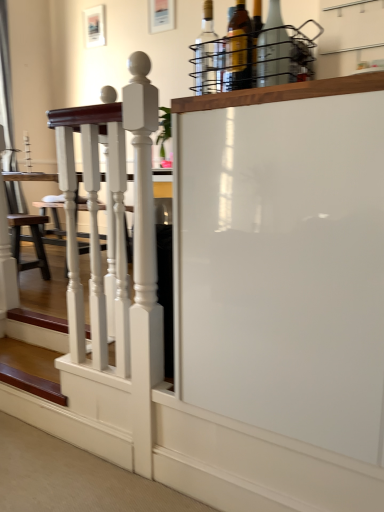
Where is `wooden stairs at lower left`? The width and height of the screenshot is (384, 512). wooden stairs at lower left is located at coordinates (39, 331).

At what (x,y) coordinates should I click in order to perform the action: click on translucent glass bottle at upper center, the second bottle when ordered from left to right. Please return your answer as a coordinate pair (x, y). Looking at the image, I should click on (230, 14).

What is the approximate width of brown leather stool at lower left?

The width of brown leather stool at lower left is 13.14 inches.

What do you see at coordinates (123, 287) in the screenshot?
I see `white glossy wooden railing at left` at bounding box center [123, 287].

Identify the location of translucent glass bottle at upper center, which appears as the 3th bottle when viewed from the right. Image resolution: width=384 pixels, height=512 pixels. (239, 49).

From the image's perspective, would you say brown leather stool at lower left is positioned over white glossy wooden railing at left?

Yes, from the image's perspective, brown leather stool at lower left is over white glossy wooden railing at left.

Which object is positioned more to the left, brown leather stool at lower left or white glossy wooden railing at left?

From the viewer's perspective, brown leather stool at lower left appears more on the left side.

Looking at this image, looking at their sizes, would you say brown leather stool at lower left is wider or thinner than white glossy wooden railing at left?

Clearly, brown leather stool at lower left has more width compared to white glossy wooden railing at left.

Can you confirm if brown leather stool at lower left is shorter than white glossy wooden railing at left?

Yes.

Which object is positioned more to the left, matte glass bottle at upper center, acting as the fourth bottle starting from the left, or translucent glass bottle at upper center, which appears as the 3th bottle when viewed from the left?

translucent glass bottle at upper center, which appears as the 3th bottle when viewed from the left.

Is the depth of matte glass bottle at upper center, acting as the fourth bottle starting from the left, less than that of translucent glass bottle at upper center, which appears as the 3th bottle when viewed from the left?

Yes, it is.

Where is `the 2nd bottle below the translucent glass bottle at upper center, which appears as the 3th bottle when viewed from the left (from the image's perspective)`? The height and width of the screenshot is (512, 384). the 2nd bottle below the translucent glass bottle at upper center, which appears as the 3th bottle when viewed from the left (from the image's perspective) is located at coordinates (x=243, y=55).

From the image's perspective, which one is positioned higher, matte glass bottle at upper center, acting as the fourth bottle starting from the left, or white glossy wooden railing at left?

From the image's view, matte glass bottle at upper center, acting as the fourth bottle starting from the left, is above.

Which is in front, point (277, 51) or point (125, 157)?

The point (277, 51) is in front.

In the scene shown: Relative to white glossy wooden railing at left, is matte glass bottle at upper center, the 2th bottle positioned from the right, in front or behind?

matte glass bottle at upper center, the 2th bottle positioned from the right, is positioned closer to the viewer than white glossy wooden railing at left.

From the image's perspective, which is below, brown leather stool at lower left or clear glass bottle at upper center, the fifth bottle in the left-to-right sequence?

From the image's view, brown leather stool at lower left is below.

Considering the positions of objects brown leather stool at lower left and clear glass bottle at upper center, which is the first bottle in right-to-left order, in the image provided, who is more to the left, brown leather stool at lower left or clear glass bottle at upper center, which is the first bottle in right-to-left order,?

Positioned to the left is brown leather stool at lower left.

Is brown leather stool at lower left smaller than clear glass bottle at upper center, which is the first bottle in right-to-left order?

No.

From a real-world perspective, which is physically below, brown leather stool at lower left or clear glass bottle at upper center, the fifth bottle in the left-to-right sequence?

From a 3D spatial view, brown leather stool at lower left is below.

Which object is wider, wooden stairs at lower left or white glossy wooden railing at left?

Wider between the two is wooden stairs at lower left.

Consider the image. Can you confirm if wooden stairs at lower left is smaller than white glossy wooden railing at left?

Indeed, wooden stairs at lower left has a smaller size compared to white glossy wooden railing at left.

How different are the orientations of wooden stairs at lower left and white glossy wooden railing at left in degrees?

178 degrees.

This screenshot has width=384, height=512. I want to click on stairs behind the matte glass bottle at upper center, acting as the fourth bottle starting from the left, so click(39, 331).

Which is behind, point (259, 74) or point (26, 324)?

Positioned behind is point (26, 324).

Which object is closer to the camera, matte glass bottle at upper center, acting as the fourth bottle starting from the left, or wooden stairs at lower left?

matte glass bottle at upper center, acting as the fourth bottle starting from the left.

Considering the sizes of matte glass bottle at upper center, acting as the fourth bottle starting from the left, and wooden stairs at lower left in the image, is matte glass bottle at upper center, acting as the fourth bottle starting from the left, wider or thinner than wooden stairs at lower left?

Clearly, matte glass bottle at upper center, acting as the fourth bottle starting from the left, has less width compared to wooden stairs at lower left.

Would you say brown leather stool at lower left is outside matte glass bottle at upper center, the 2th bottle positioned from the right?

Absolutely, brown leather stool at lower left is external to matte glass bottle at upper center, the 2th bottle positioned from the right.

Based on the photo, in terms of width, does brown leather stool at lower left look wider or thinner when compared to matte glass bottle at upper center, acting as the fourth bottle starting from the left?

brown leather stool at lower left is wider than matte glass bottle at upper center, acting as the fourth bottle starting from the left.

From a real-world perspective, who is located higher, brown leather stool at lower left or matte glass bottle at upper center, the 2th bottle positioned from the right?

matte glass bottle at upper center, the 2th bottle positioned from the right, from a real-world perspective.

Considering the positions of points (15, 248) and (281, 80), is point (15, 248) closer to camera compared to point (281, 80)?

No, it is behind (281, 80).

The height and width of the screenshot is (512, 384). I want to click on rail that is below the brown leather stool at lower left (from the image's perspective), so click(x=123, y=287).

Image resolution: width=384 pixels, height=512 pixels. Identify the location of the 2nd bottle in front of the translucent glass bottle at upper center, which appears as the 3th bottle when viewed from the left. (243, 55).

Looking at the image, which one is located further to matte glass bottle at upper center, acting as the fourth bottle starting from the left, translucent glass bottle at upper center, which appears as the 3th bottle when viewed from the left, or wooden stairs at lower left?

The object further to matte glass bottle at upper center, acting as the fourth bottle starting from the left, is wooden stairs at lower left.

Looking at the image, which one is located further to translucent glass bottle at upper center, which appears as the 3th bottle when viewed from the left, white glossy wooden railing at left or translucent glass bottle at upper center, which appears as the 4th bottle when viewed from the right?

Among the two, white glossy wooden railing at left is located further to translucent glass bottle at upper center, which appears as the 3th bottle when viewed from the left.

Estimate the real-world distances between objects in this image. Which object is closer to wooden stairs at lower left, brown leather stool at lower left or translucent glass bottle at upper center, which appears as the 3th bottle when viewed from the right?

brown leather stool at lower left.

Based on their spatial positions, is matte glass bottle at upper center, the 2th bottle positioned from the right, or wooden stairs at lower left further from white glossy wooden railing at left?

Based on the image, matte glass bottle at upper center, the 2th bottle positioned from the right, appears to be further to white glossy wooden railing at left.

Based on their spatial positions, is white glossy wooden railing at left or wooden stairs at lower left closer to brown leather stool at lower left?

The object closer to brown leather stool at lower left is wooden stairs at lower left.

From the image, which object appears to be nearer to clear glass bottle at upper center, the fifth bottle in the left-to-right sequence, translucent glass bottle at upper center, which appears as the 4th bottle when viewed from the right, or translucent glass bottle at upper center, which appears as the 3th bottle when viewed from the right?

translucent glass bottle at upper center, which appears as the 3th bottle when viewed from the right.

Considering their positions, is translucent glass bottle at upper center, which appears as the 4th bottle when viewed from the right, positioned closer to matte glass bottle at upper center, the 2th bottle positioned from the right, than white glossy screen door at center?

translucent glass bottle at upper center, which appears as the 4th bottle when viewed from the right, is closer to matte glass bottle at upper center, the 2th bottle positioned from the right.

Looking at the image, which one is located closer to white glossy screen door at center, translucent glass bottle at upper center, which appears as the 3th bottle when viewed from the left, or white glossy wooden railing at left?

white glossy wooden railing at left is closer to white glossy screen door at center.

I want to click on rail that lies between translucent glass bottle at upper center, which appears as the 3th bottle when viewed from the right, and wooden stairs at lower left from top to bottom, so click(123, 287).

This screenshot has height=512, width=384. Identify the location of rail between wooden stairs at lower left and white glossy screen door at center from left to right. (123, 287).

Locate an element on the screen. rail between translucent glass bottle at upper center, which appears as the 3th bottle when viewed from the left, and brown leather stool at lower left from front to back is located at coordinates tap(123, 287).

The image size is (384, 512). Find the location of `rail between clear glass bottle at upper center, the first bottle viewed from the left, and wooden stairs at lower left, in the vertical direction`. rail between clear glass bottle at upper center, the first bottle viewed from the left, and wooden stairs at lower left, in the vertical direction is located at coordinates (123, 287).